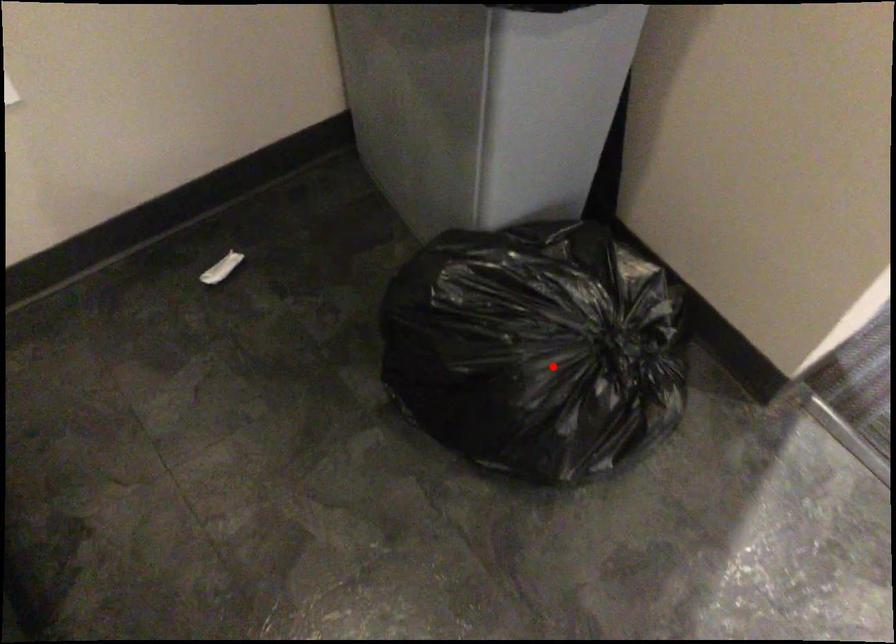
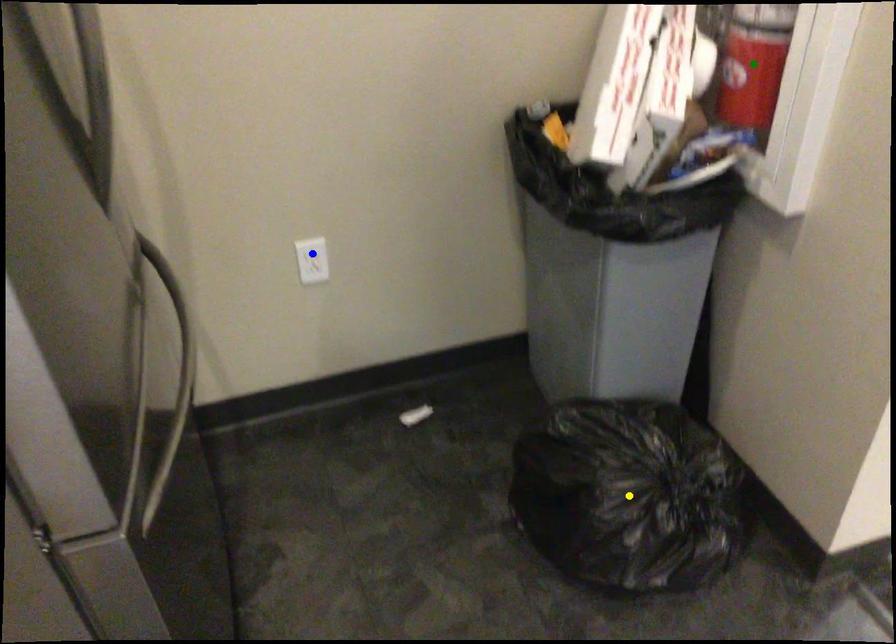
Question: I am providing you with two images of the same scene from different viewpoints. A red point is marked on the first image. You are given multiple points on the second image. Which mark in image 2 goes with the point in image 1?

Choices:
 (A) yellow point
 (B) green point
 (C) blue point

Answer: (A)